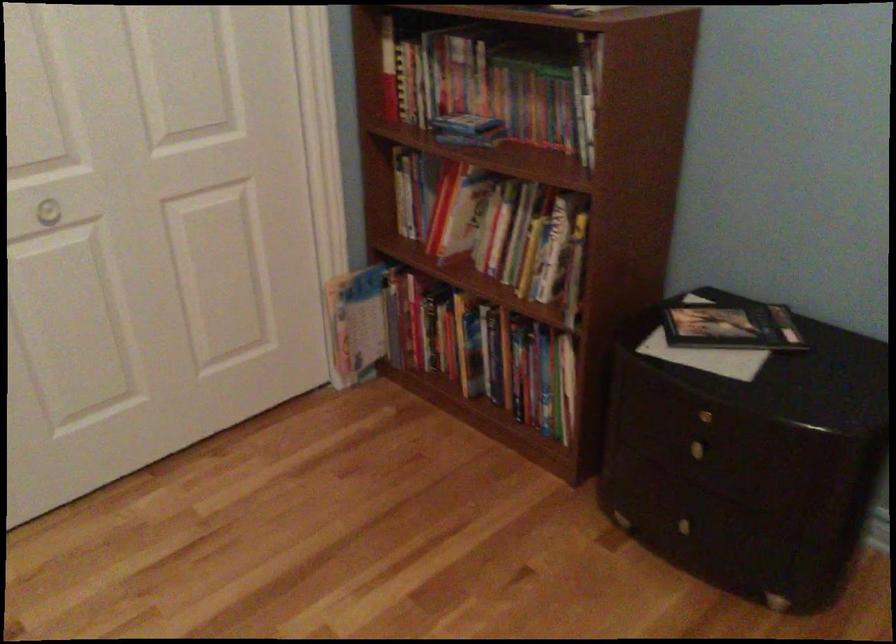
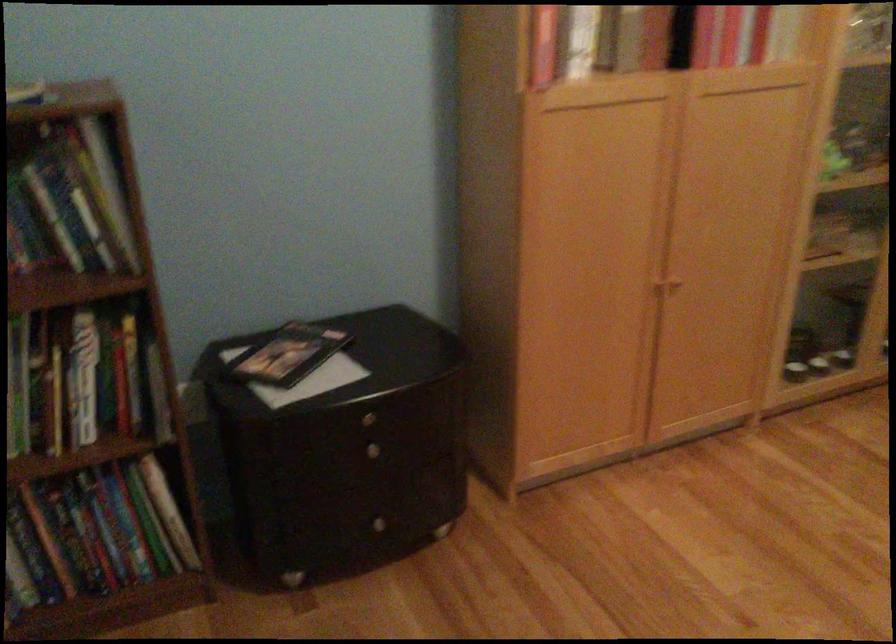
Find the pixel in the second image that matches [711,412] in the first image.

(367, 415)